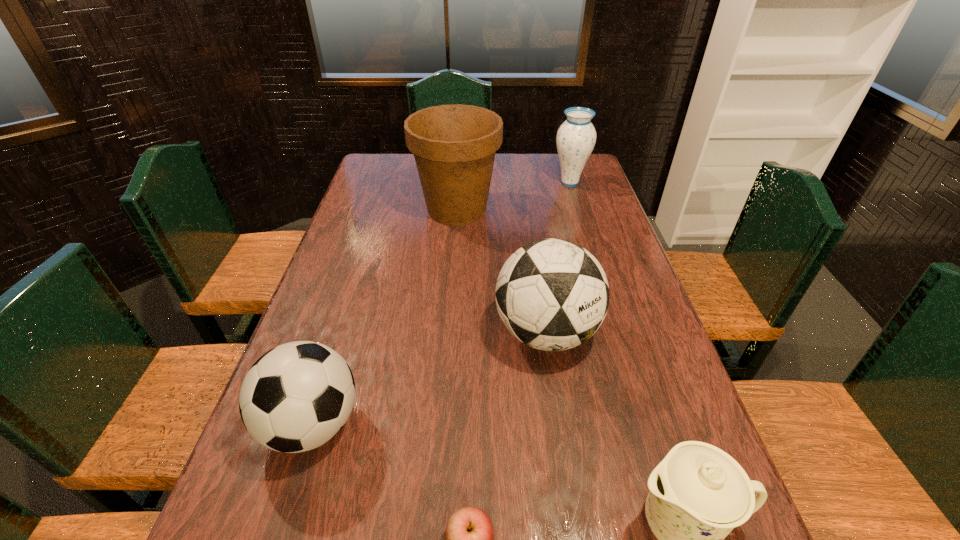
The height and width of the screenshot is (540, 960). Find the location of `unoccupied position between the third nearest object and the vase`. unoccupied position between the third nearest object and the vase is located at coordinates (442, 303).

The width and height of the screenshot is (960, 540). Identify the location of free space between the vase and the flowerpot. (514, 196).

At what (x,y) coordinates should I click in order to perform the action: click on free space between the vase and the fourth farthest object. Please return your answer as a coordinate pair (x, y). The height and width of the screenshot is (540, 960). Looking at the image, I should click on (442, 303).

Find the location of a particular element. free space between the vase and the flowerpot is located at coordinates (514, 196).

Locate an element on the screen. The image size is (960, 540). unoccupied area between the shorter soccer ball and the vase is located at coordinates [x=442, y=303].

Identify which object is the closest to the chinaware. Please provide its 2D coordinates. Your answer should be formatted as a tuple, i.e. [(x, y)], where the tuple contains the x and y coordinates of a point satisfying the conditions above.

[(469, 534)]

Locate which object ranks fourth in proximity to the flowerpot. Please provide its 2D coordinates. Your answer should be formatted as a tuple, i.e. [(x, y)], where the tuple contains the x and y coordinates of a point satisfying the conditions above.

[(698, 494)]